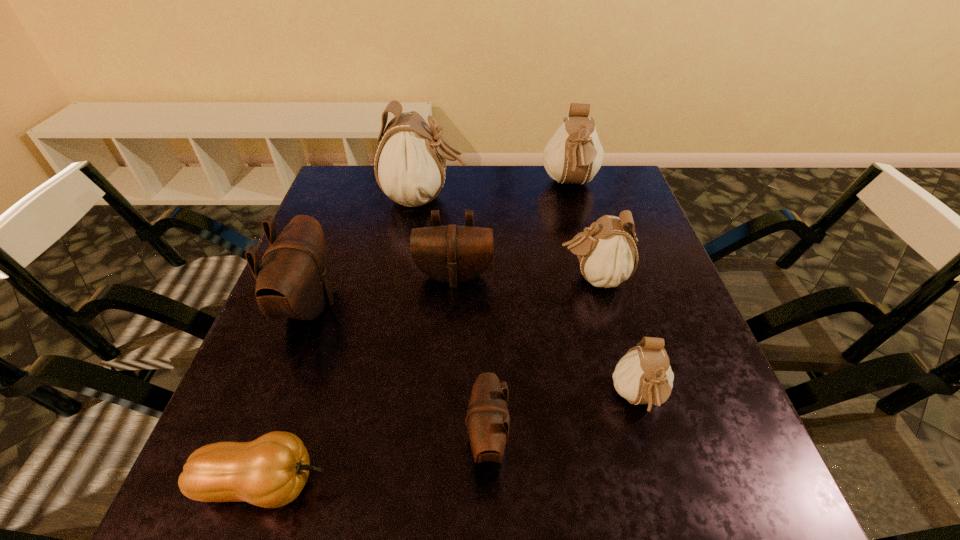
Find the location of a particular element. The width and height of the screenshot is (960, 540). vacant area that lies between the biggest white pouch and the third biggest white pouch is located at coordinates (509, 238).

This screenshot has height=540, width=960. I want to click on free space between the tallest pouch and the leftmost pouch, so click(x=367, y=251).

Image resolution: width=960 pixels, height=540 pixels. In order to click on vacant area that lies between the nearest white pouch and the second biggest brown pouch in this screenshot , I will do `click(546, 338)`.

You are a GUI agent. You are given a task and a screenshot of the screen. Output one action in this format:
    pyautogui.click(x=<x>, y=<y>)
    Task: Click on the seventh closest object to the third smallest white pouch
    This screenshot has height=540, width=960.
    Given the screenshot: What is the action you would take?
    (271, 471)

Image resolution: width=960 pixels, height=540 pixels. What are the coordinates of `the seventh closest object to the gourd` in the screenshot? It's located at (574, 154).

The image size is (960, 540). Identify the location of pouch identified as the third closest to the smallest white pouch. (453, 254).

At what (x,y) coordinates should I click in order to perform the action: click on the closest pouch relative to the biggest white pouch. Please return your answer as a coordinate pair (x, y). Looking at the image, I should click on (453, 254).

Find the location of a particular element. the closest white pouch relative to the leftmost pouch is located at coordinates (410, 165).

This screenshot has height=540, width=960. Find the location of `white pouch object that ranks as the second closest to the biggest white pouch`. white pouch object that ranks as the second closest to the biggest white pouch is located at coordinates (607, 253).

Find the location of `brown pouch that can be found as the closest to the smallest brown pouch`. brown pouch that can be found as the closest to the smallest brown pouch is located at coordinates (453, 254).